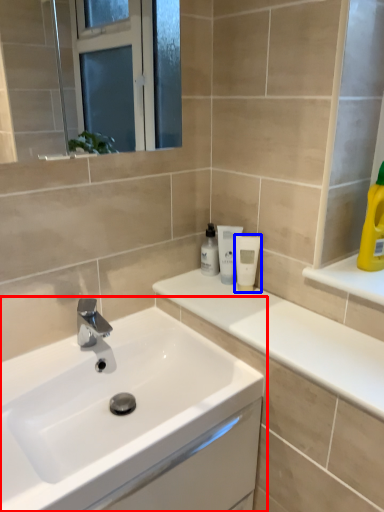
Question: Among these objects, which one is farthest to the camera, sink (highlighted by a red box) or mouthwash (highlighted by a blue box)?

Choices:
 (A) sink
 (B) mouthwash

Answer: (B)